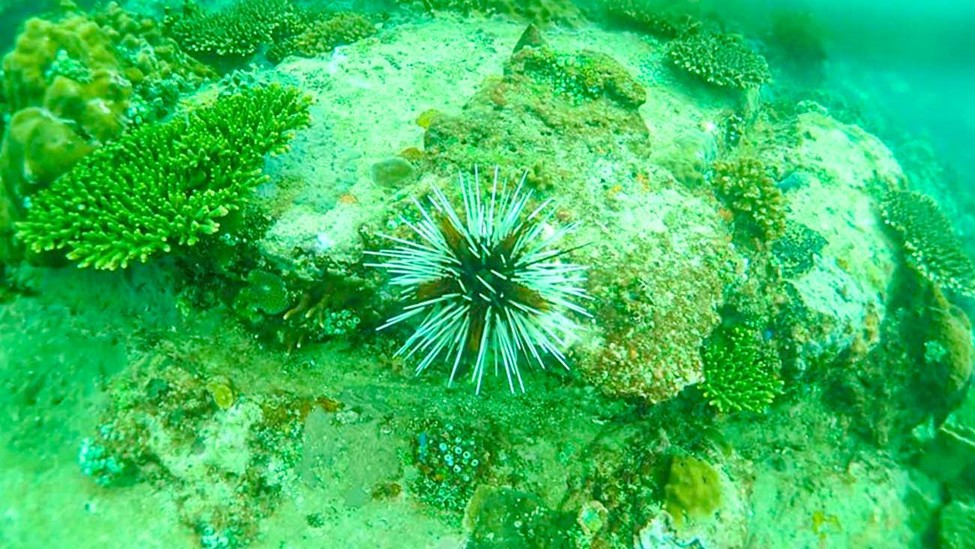
This screenshot has height=549, width=975. In order to click on plant on the top left in this screenshot , I will do `click(51, 36)`.